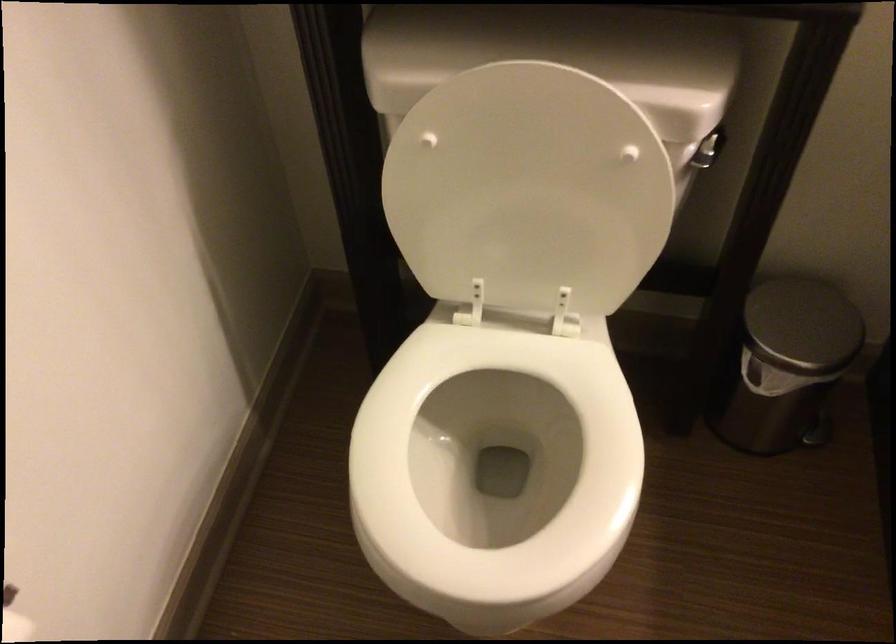
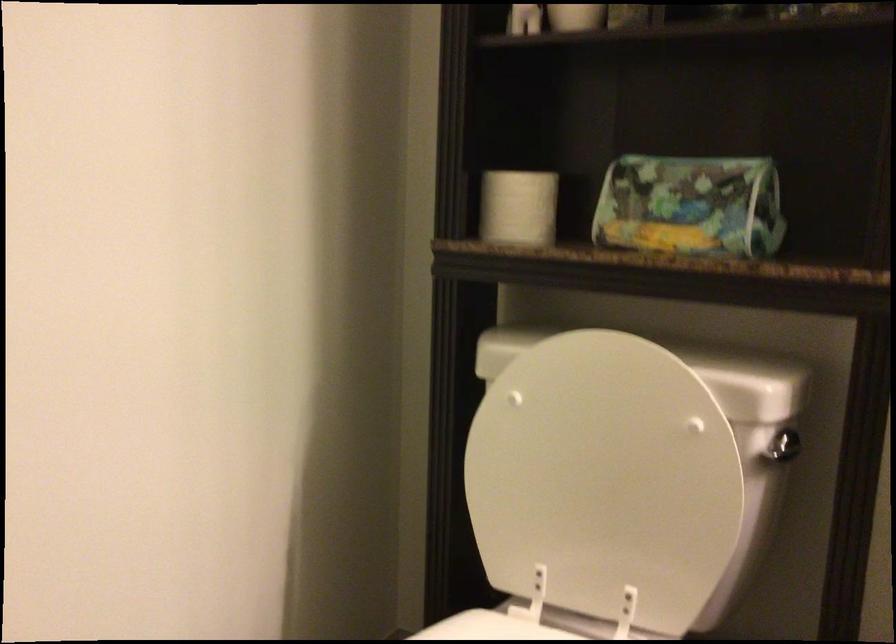
The first image is from the beginning of the video and the second image is from the end. How did the camera likely rotate when shooting the video?

The rotation direction of the camera is left-up.